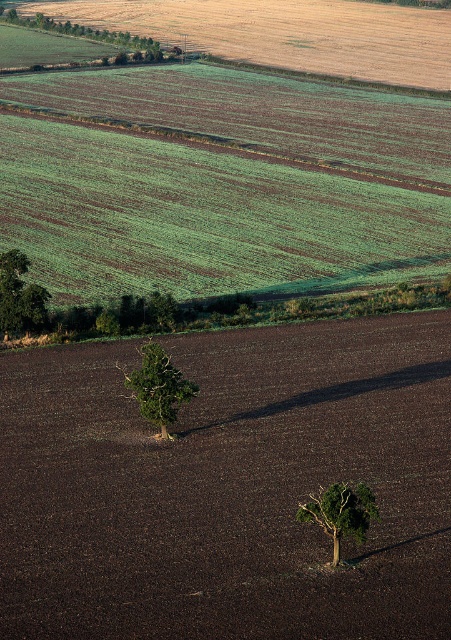
Question: Which point appears closest to the camera in this image?

Choices:
 (A) 313,452
 (B) 26,300
 (C) 170,413

Answer: (A)

Question: Is green leafy tree at center to the right of green leafy tree at left from the viewer's perspective?

Choices:
 (A) yes
 (B) no

Answer: (A)

Question: Does green grassy field at center lie behind green matte tree at center-left?

Choices:
 (A) no
 (B) yes

Answer: (B)

Question: Estimate the real-world distances between objects in this image. Which object is farther from the green matte tree at center?

Choices:
 (A) green grassy field at center
 (B) green matte tree at center-left
 (C) green leafy tree at left
 (D) green leafy tree at center

Answer: (A)

Question: Among these objects, which one is farthest from the camera?

Choices:
 (A) green leafy tree at left
 (B) green leafy tree at center

Answer: (A)

Question: Is green leafy tree at center to the right of green grassy field at center from the viewer's perspective?

Choices:
 (A) yes
 (B) no

Answer: (A)